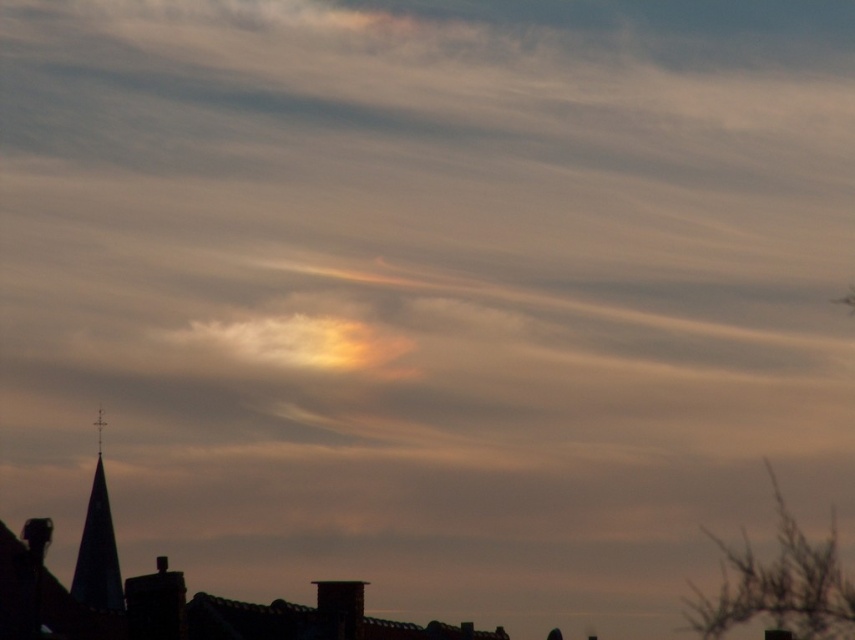
Question: Can you confirm if golden translucent cloud at center is wider than dark gray stone spire at lower left?

Choices:
 (A) no
 (B) yes

Answer: (B)

Question: Considering the relative positions of golden translucent cloud at center and dark gray stone spire at lower left in the image provided, where is golden translucent cloud at center located with respect to dark gray stone spire at lower left?

Choices:
 (A) below
 (B) above

Answer: (B)

Question: Among these points, which one is nearest to the camera?

Choices:
 (A) (107, 493)
 (B) (207, 348)

Answer: (A)

Question: Observing the image, what is the correct spatial positioning of golden translucent cloud at center in reference to dark gray stone spire at lower left?

Choices:
 (A) left
 (B) right

Answer: (A)

Question: Which point is closer to the camera?

Choices:
 (A) dark gray stone spire at lower left
 (B) golden translucent cloud at center

Answer: (A)